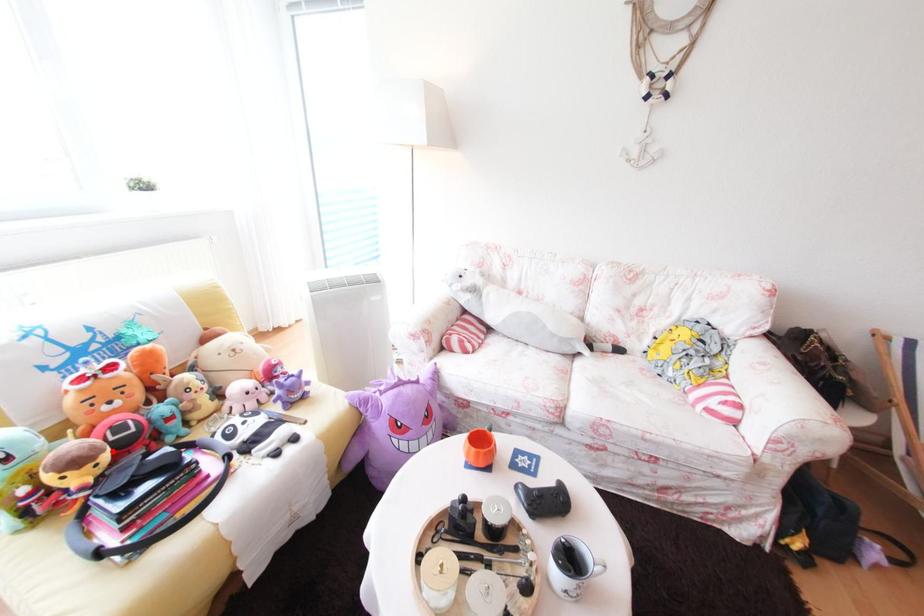
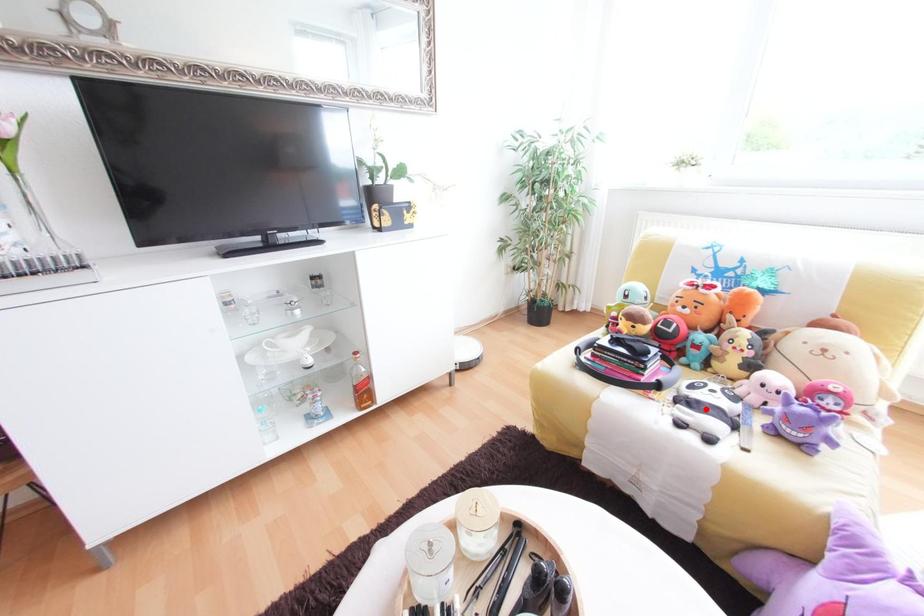
I am providing you with two images of the same scene from different viewpoints. A red point is marked on the first image and another point is marked on the second image. Does the point marked in image1 correspond to the same location as the one in image2?

No